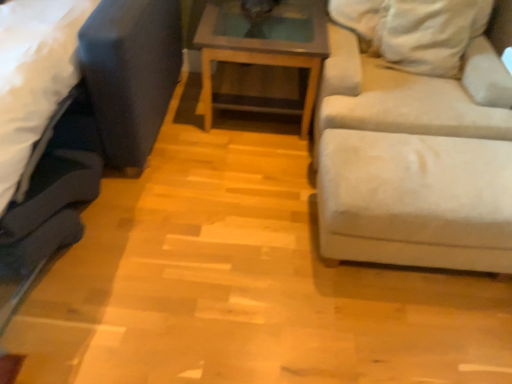
Question: Choose the correct answer: Is beige fabric couch at right, positioned as the first studio couch in right-to-left order, inside wooden glass top table at center or outside it?

Choices:
 (A) outside
 (B) inside

Answer: (A)

Question: Is beige fabric couch at right, positioned as the first studio couch in right-to-left order, in front of or behind wooden glass top table at center in the image?

Choices:
 (A) front
 (B) behind

Answer: (A)

Question: Based on their relative distances, which object is nearer to the beige fabric couch at right, positioned as the first studio couch in right-to-left order?

Choices:
 (A) wooden glass top table at center
 (B) velvet dark blue studio couch at left, the 2th studio couch positioned from the right

Answer: (A)

Question: Estimate the real-world distances between objects in this image. Which object is farther from the velvet dark blue studio couch at left, acting as the first studio couch starting from the left?

Choices:
 (A) wooden glass top table at center
 (B) beige fabric couch at right, which is counted as the 2th studio couch, starting from the left

Answer: (B)